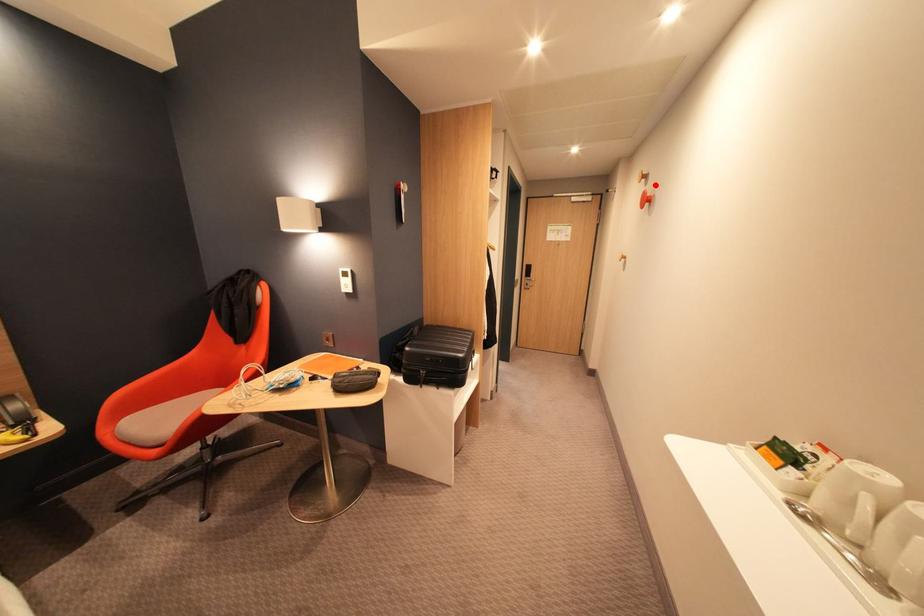
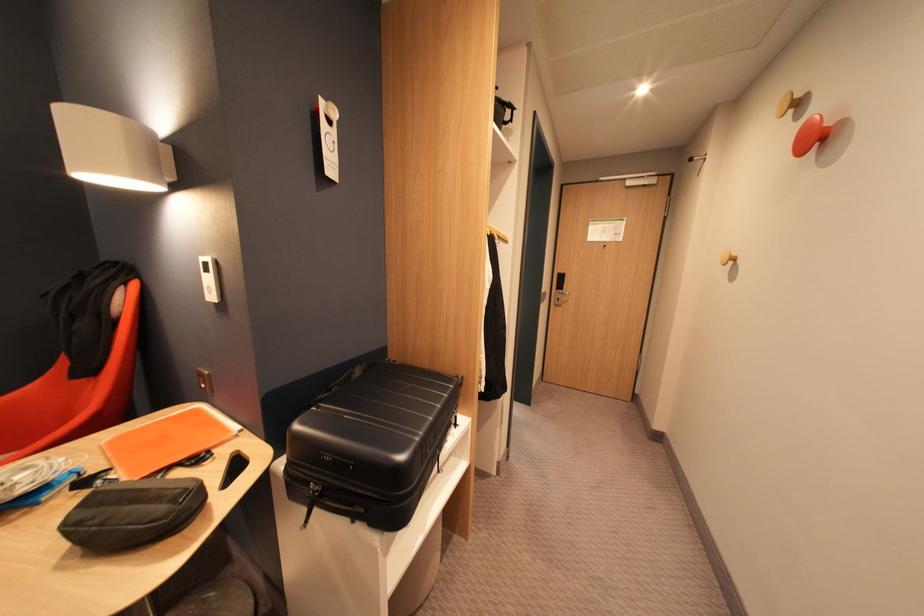
Locate, in the second image, the point that corresponds to the highlighted location in the first image.

(809, 118)